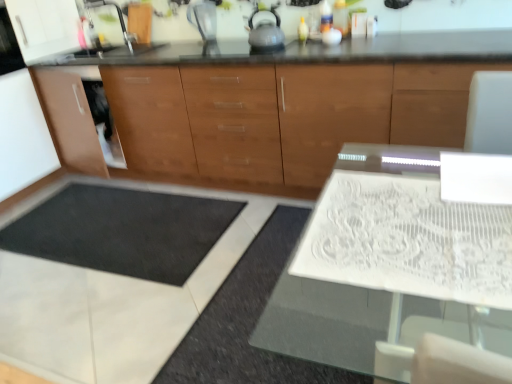
Question: From a real-world perspective, is brown wood cabinet at center physically above transparent plastic blender at upper center?

Choices:
 (A) no
 (B) yes

Answer: (A)

Question: Does brown wood cabinet at center have a larger size compared to transparent plastic blender at upper center?

Choices:
 (A) no
 (B) yes

Answer: (B)

Question: Considering the relative sizes of brown wood cabinet at center and transparent plastic blender at upper center in the image provided, is brown wood cabinet at center wider than transparent plastic blender at upper center?

Choices:
 (A) yes
 (B) no

Answer: (A)

Question: Considering the relative sizes of brown wood cabinet at center and transparent plastic blender at upper center in the image provided, is brown wood cabinet at center thinner than transparent plastic blender at upper center?

Choices:
 (A) yes
 (B) no

Answer: (B)

Question: Is brown wood cabinet at center oriented away from transparent plastic blender at upper center?

Choices:
 (A) no
 (B) yes

Answer: (A)

Question: Is point (322, 211) positioned closer to the camera than point (275, 19)?

Choices:
 (A) closer
 (B) farther

Answer: (A)

Question: In the image, is white glass table at center on the left side or the right side of satin silver tea pot at upper center?

Choices:
 (A) left
 (B) right

Answer: (B)

Question: Do you think white glass table at center is within satin silver tea pot at upper center, or outside of it?

Choices:
 (A) outside
 (B) inside

Answer: (A)

Question: From the image's perspective, is white glass table at center above or below satin silver tea pot at upper center?

Choices:
 (A) below
 (B) above

Answer: (A)

Question: Which is correct: brown wood cabinet at center is inside white glass table at center, or outside of it?

Choices:
 (A) outside
 (B) inside

Answer: (A)

Question: In the image, is brown wood cabinet at center on the left side or the right side of white glass table at center?

Choices:
 (A) left
 (B) right

Answer: (A)

Question: Based on their sizes in the image, would you say brown wood cabinet at center is bigger or smaller than white glass table at center?

Choices:
 (A) big
 (B) small

Answer: (A)

Question: In terms of height, does brown wood cabinet at center look taller or shorter compared to white glass table at center?

Choices:
 (A) tall
 (B) short

Answer: (A)

Question: Which is correct: transparent plastic blender at upper center is inside brown wood cabinet at center, or outside of it?

Choices:
 (A) outside
 (B) inside

Answer: (A)

Question: In the image, is transparent plastic blender at upper center positioned in front of or behind brown wood cabinet at center?

Choices:
 (A) front
 (B) behind

Answer: (B)